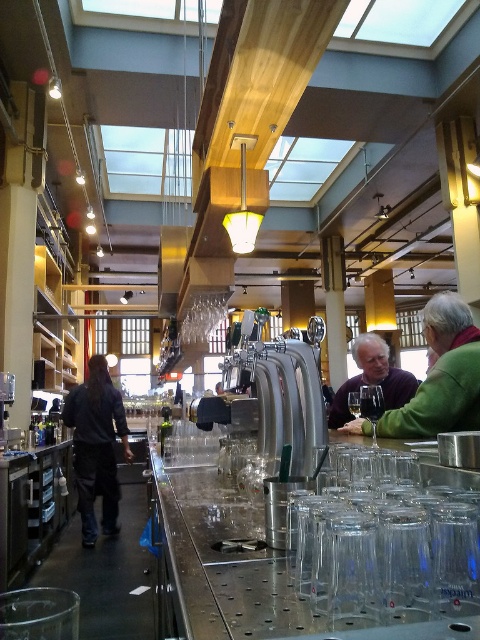
You are a bartender who needs to place a new coat on the bar counter. The coat you want to place is the same size as the dark gray jacket at left. There is already a clear glass wine glass at bar on the counter. Will the new coat fit on the counter without overlapping the wine glass?

The dark gray jacket at left has a greater height compared to clear glass wine glass at bar, so the new coat, being the same size as the dark gray jacket at left, will also be taller than the wine glass. Therefore, the coat might not fit on the counter without overlapping the wine glass if there isn

You are a bartender who needs to place a new drink order on the bar counter. You have a large tray that is the same width as the dark gray jacket at left. Can you fit the tray next to the clear glass wine glass at bar without overlapping?

The dark gray jacket at left is wider than the clear glass wine glass at bar. Since the tray is as wide as the jacket, it would be wider than the wine glass. However, the exact available space isn